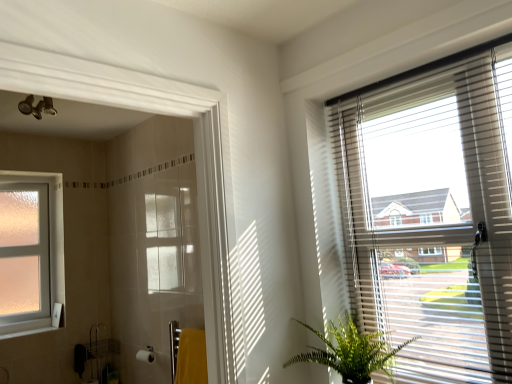
Question: In terms of width, does yellow fabric towel at lower center look wider or thinner when compared to white glossy shower door at left?

Choices:
 (A) thin
 (B) wide

Answer: (A)

Question: From a real-world perspective, relative to white glossy shower door at left, is yellow fabric towel at lower center vertically above or below?

Choices:
 (A) below
 (B) above

Answer: (A)

Question: Which of these objects is positioned closest to the yellow fabric towel at lower center?

Choices:
 (A) white glossy shower door at left
 (B) green leafy plant at lower right
 (C) matte gray blinds at upper right
 (D) white plastic window sill at lower left
 (E) frosted glass window at left

Answer: (B)

Question: Estimate the real-world distances between objects in this image. Which object is farther from the white glossy shower door at left?

Choices:
 (A) white plastic window sill at lower left
 (B) frosted glass window at left
 (C) green leafy plant at lower right
 (D) matte gray blinds at upper right
 (E) yellow fabric towel at lower center

Answer: (A)